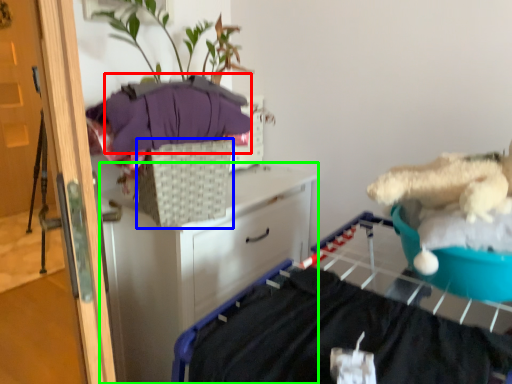
Question: Estimate the real-world distances between objects in this image. Which object is farther from clothing (highlighted by a red box), basket (highlighted by a blue box) or chest of drawers (highlighted by a green box)?

Choices:
 (A) basket
 (B) chest of drawers

Answer: (B)